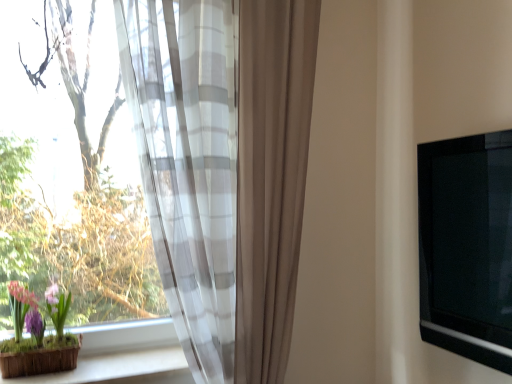
Question: Is matte brown pot at lower left situated inside sheer white and gray striped curtain at left or outside?

Choices:
 (A) inside
 (B) outside

Answer: (B)

Question: Looking at the image, does matte brown pot at lower left seem bigger or smaller compared to sheer white and gray striped curtain at left?

Choices:
 (A) small
 (B) big

Answer: (A)

Question: Estimate the real-world distances between objects in this image. Which object is closer to the wooden at lower left?

Choices:
 (A) transparent fabric at left
 (B) sheer white and gray striped curtain at left
 (C) matte brown pot at lower left
 (D) black glossy tv at right

Answer: (C)

Question: Estimate the real-world distances between objects in this image. Which object is closer to the matte brown pot at lower left?

Choices:
 (A) black glossy tv at right
 (B) sheer white and gray striped curtain at left
 (C) transparent fabric at left
 (D) wooden at lower left

Answer: (D)